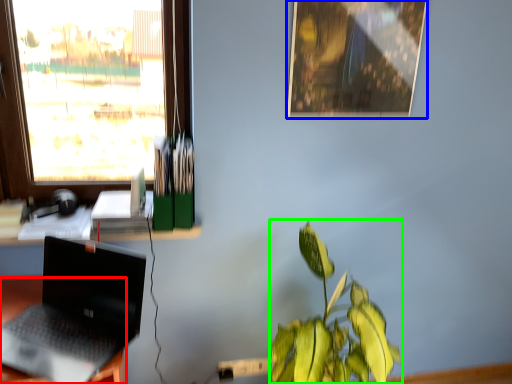
Question: Estimate the real-world distances between objects in this image. Which object is farther from desk (highlighted by a red box), picture frame (highlighted by a blue box) or houseplant (highlighted by a green box)?

Choices:
 (A) picture frame
 (B) houseplant

Answer: (A)